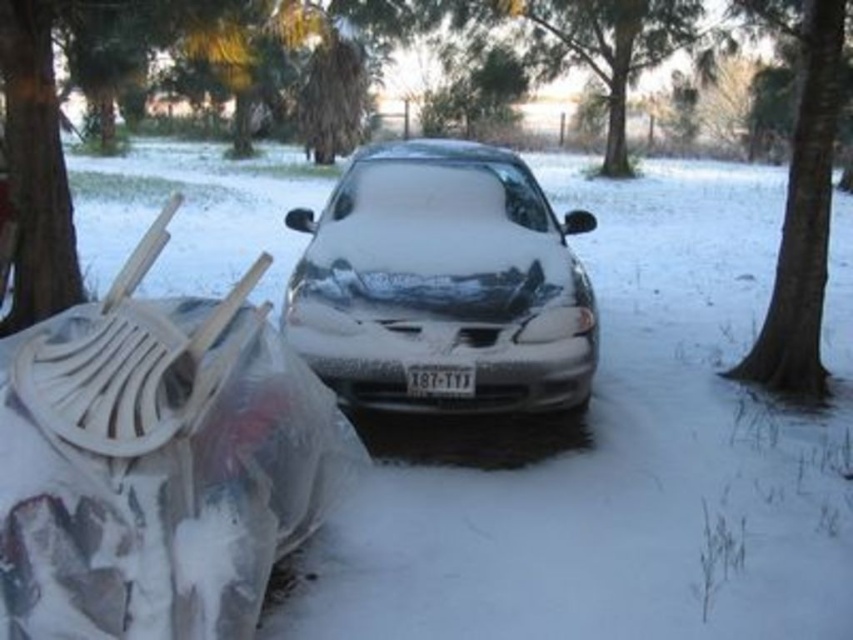
Question: Which point is farther from the camera taking this photo?

Choices:
 (A) (772, 376)
 (B) (387, 198)
 (C) (608, 77)

Answer: (C)

Question: Can you confirm if green leafy tree at upper center is wider than white plastic license plate at center?

Choices:
 (A) no
 (B) yes

Answer: (B)

Question: Can you confirm if green leafy tree at upper center is wider than white plastic license plate at center?

Choices:
 (A) no
 (B) yes

Answer: (B)

Question: Which point is closer to the camera taking this photo?

Choices:
 (A) (555, 324)
 (B) (836, 67)

Answer: (A)

Question: Which of the following is the farthest from the observer?

Choices:
 (A) (824, 16)
 (B) (654, 54)
 (C) (372, 268)

Answer: (B)

Question: Is sleek metallic car at center above white plastic license plate at center?

Choices:
 (A) yes
 (B) no

Answer: (A)